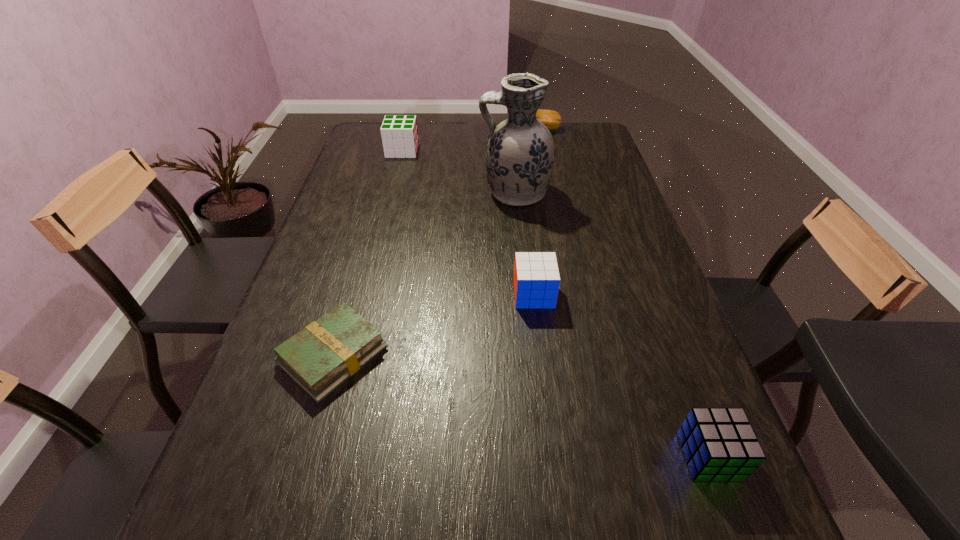
Where is `vacant area that lies between the fifth farthest object and the rightmost cube`? vacant area that lies between the fifth farthest object and the rightmost cube is located at coordinates tap(521, 406).

Where is `vacant area that lies between the third farthest object and the shortest object`? vacant area that lies between the third farthest object and the shortest object is located at coordinates (424, 274).

The height and width of the screenshot is (540, 960). Find the location of `vacant area that lies between the tallest object and the third nearest object`. vacant area that lies between the tallest object and the third nearest object is located at coordinates (524, 244).

Locate which object ranks fifth in proximity to the vase. Please provide its 2D coordinates. Your answer should be formatted as a tuple, i.e. [(x, y)], where the tuple contains the x and y coordinates of a point satisfying the conditions above.

[(719, 444)]

The image size is (960, 540). In order to click on object that stands as the fifth closest to the farthest object in this screenshot , I will do `click(719, 444)`.

Identify the location of the closest cube relative to the third nearest object. This screenshot has height=540, width=960. (719, 444).

At what (x,y) coordinates should I click in order to perform the action: click on cube that is the second closest to the third nearest object. Please return your answer as a coordinate pair (x, y). The width and height of the screenshot is (960, 540). Looking at the image, I should click on (399, 133).

This screenshot has height=540, width=960. Find the location of `free space that satisfies the following two spatial constraints: 1. on the red face of the farthest cube; 2. on the right side of the nearest object`. free space that satisfies the following two spatial constraints: 1. on the red face of the farthest cube; 2. on the right side of the nearest object is located at coordinates (324, 456).

Locate an element on the screen. vacant area that satisfies the following two spatial constraints: 1. with the handle on the side of the tallest object; 2. on the red face of the farthest cube is located at coordinates (510, 151).

The height and width of the screenshot is (540, 960). Identify the location of vacant space that satisfies the following two spatial constraints: 1. on the red face of the nearest object; 2. on the right side of the fifth nearest object. (324, 456).